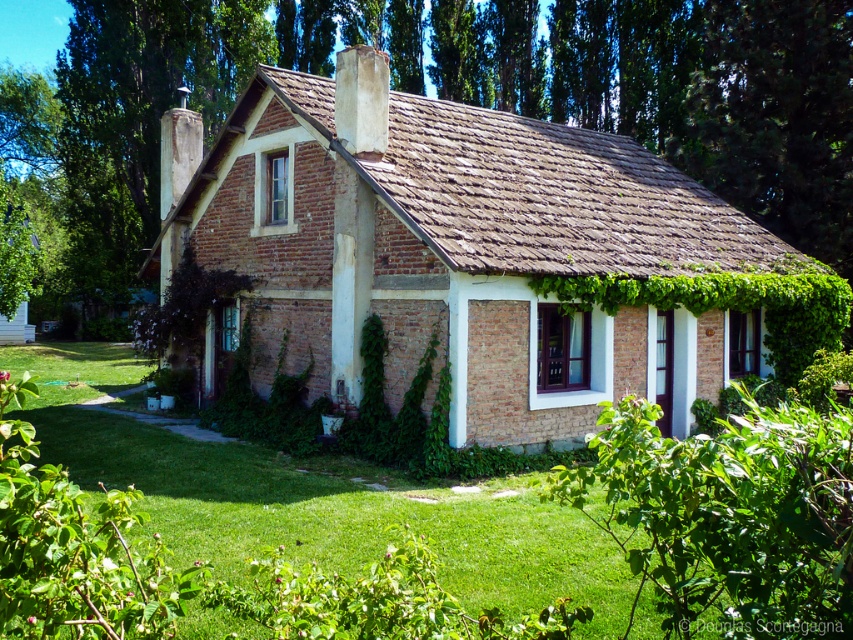
You are a gardener planning to mow the lawn in front of the house. You have a lawnmower that can only handle areas wider than the green leafy hedge at lower right. Based on the scene, will the green grass at center be wide enough for your lawnmower to handle?

The green grass at center is wider than the green leafy hedge at lower right, so yes, the lawnmower can handle the green grass at center since its width exceeds the hedge.

You are standing in front of the house and want to walk to the green leafy hedge at lower right. Which direction should you move relative to the green grass at center?

You should move to the right relative to the green grass at center because the green leafy hedge at lower right is located to the right of the green grass at center.